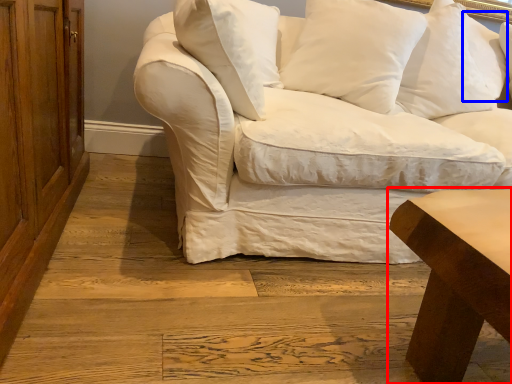
Question: Which object appears closest to the camera in this image, table (highlighted by a red box) or pillow (highlighted by a blue box)?

Choices:
 (A) table
 (B) pillow

Answer: (A)